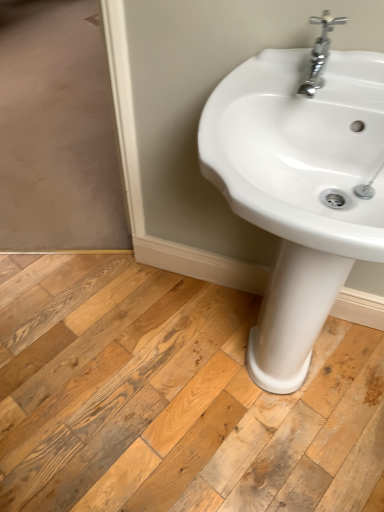
Question: Is chrome metallic faucet at upper right facing towards white glossy sink at center?

Choices:
 (A) yes
 (B) no

Answer: (B)

Question: From a real-world perspective, is chrome metallic faucet at upper right under white glossy sink at center?

Choices:
 (A) no
 (B) yes

Answer: (A)

Question: From a real-world perspective, is chrome metallic faucet at upper right located higher than white glossy sink at center?

Choices:
 (A) yes
 (B) no

Answer: (A)

Question: Can you confirm if chrome metallic faucet at upper right is wider than white glossy sink at center?

Choices:
 (A) no
 (B) yes

Answer: (A)

Question: Is chrome metallic faucet at upper right turned away from white glossy sink at center?

Choices:
 (A) no
 (B) yes

Answer: (A)

Question: Does chrome metallic faucet at upper right have a larger size compared to white glossy sink at center?

Choices:
 (A) yes
 (B) no

Answer: (B)

Question: Would you say white glossy sink at center is a long distance from chrome metallic faucet at upper right?

Choices:
 (A) yes
 (B) no

Answer: (B)

Question: Would you say chrome metallic faucet at upper right is part of white glossy sink at center's contents?

Choices:
 (A) yes
 (B) no

Answer: (A)

Question: Is white glossy sink at center not within chrome metallic faucet at upper right?

Choices:
 (A) yes
 (B) no

Answer: (A)

Question: Can you confirm if white glossy sink at center is smaller than chrome metallic faucet at upper right?

Choices:
 (A) no
 (B) yes

Answer: (A)

Question: Does white glossy sink at center come in front of chrome metallic faucet at upper right?

Choices:
 (A) yes
 (B) no

Answer: (A)

Question: From a real-world perspective, is white glossy sink at center physically above chrome metallic faucet at upper right?

Choices:
 (A) yes
 (B) no

Answer: (B)

Question: Considering the relative sizes of natural wood floor at center and chrome metallic faucet at upper right in the image provided, is natural wood floor at center taller than chrome metallic faucet at upper right?

Choices:
 (A) yes
 (B) no

Answer: (B)